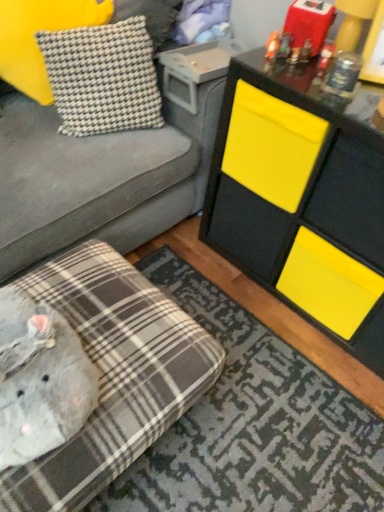
Question: Could houndstooth fabric pillow at upper left, acting as the second pillow starting from the left, be considered to be inside yellow matte cabinet at upper right?

Choices:
 (A) yes
 (B) no

Answer: (B)

Question: From the image's perspective, is yellow matte cabinet at upper right over houndstooth fabric pillow at upper left, acting as the second pillow starting from the left?

Choices:
 (A) no
 (B) yes

Answer: (A)

Question: Considering the relative positions of yellow matte cabinet at upper right and houndstooth fabric pillow at upper left, acting as the second pillow starting from the left, in the image provided, is yellow matte cabinet at upper right to the right of houndstooth fabric pillow at upper left, acting as the second pillow starting from the left, from the viewer's perspective?

Choices:
 (A) yes
 (B) no

Answer: (A)

Question: Is yellow matte cabinet at upper right positioned in front of houndstooth fabric pillow at upper left, placed as the 1th pillow when sorted from right to left?

Choices:
 (A) no
 (B) yes

Answer: (B)

Question: Can you confirm if yellow matte cabinet at upper right is bigger than houndstooth fabric pillow at upper left, placed as the 1th pillow when sorted from right to left?

Choices:
 (A) yes
 (B) no

Answer: (A)

Question: Does yellow matte cabinet at upper right have a greater height compared to houndstooth fabric pillow at upper left, placed as the 1th pillow when sorted from right to left?

Choices:
 (A) no
 (B) yes

Answer: (B)

Question: Is matte orange figurine at upper right, which appears as the 2th toy when viewed from the right, smaller than gray corduroy studio couch at upper left, the 1th studio couch viewed from the top?

Choices:
 (A) yes
 (B) no

Answer: (A)

Question: Is matte orange figurine at upper right, which appears as the 2th toy when viewed from the right, far away from gray corduroy studio couch at upper left, which is the 2th studio couch from bottom to top?

Choices:
 (A) no
 (B) yes

Answer: (A)

Question: From the image's perspective, is matte orange figurine at upper right, which is counted as the first toy, starting from the left, below gray corduroy studio couch at upper left, which is the 2th studio couch from bottom to top?

Choices:
 (A) yes
 (B) no

Answer: (B)

Question: Considering the relative positions of matte orange figurine at upper right, which is counted as the first toy, starting from the left, and gray corduroy studio couch at upper left, the 1th studio couch viewed from the top, in the image provided, is matte orange figurine at upper right, which is counted as the first toy, starting from the left, behind gray corduroy studio couch at upper left, the 1th studio couch viewed from the top,?

Choices:
 (A) no
 (B) yes

Answer: (B)

Question: Is gray corduroy studio couch at upper left, which is the 2th studio couch from bottom to top, inside matte orange figurine at upper right, which is counted as the first toy, starting from the left?

Choices:
 (A) yes
 (B) no

Answer: (B)

Question: Considering the relative sizes of matte orange figurine at upper right, which appears as the 2th toy when viewed from the right, and gray corduroy studio couch at upper left, the 1th studio couch viewed from the top, in the image provided, is matte orange figurine at upper right, which appears as the 2th toy when viewed from the right, taller than gray corduroy studio couch at upper left, the 1th studio couch viewed from the top,?

Choices:
 (A) yes
 (B) no

Answer: (B)

Question: Is yellow matte cabinet at upper right further to camera compared to gray corduroy studio couch at upper left, which is the 2th studio couch from bottom to top?

Choices:
 (A) no
 (B) yes

Answer: (B)